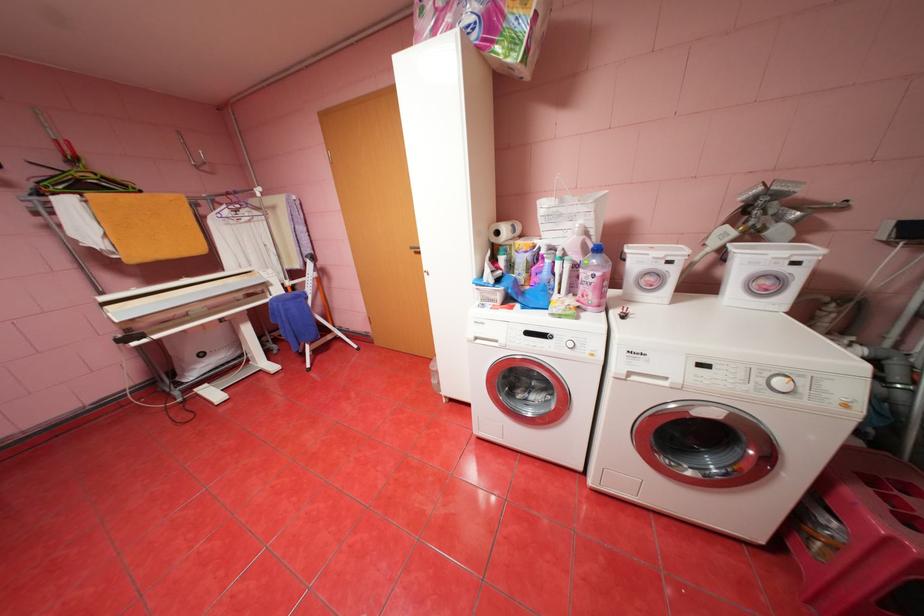
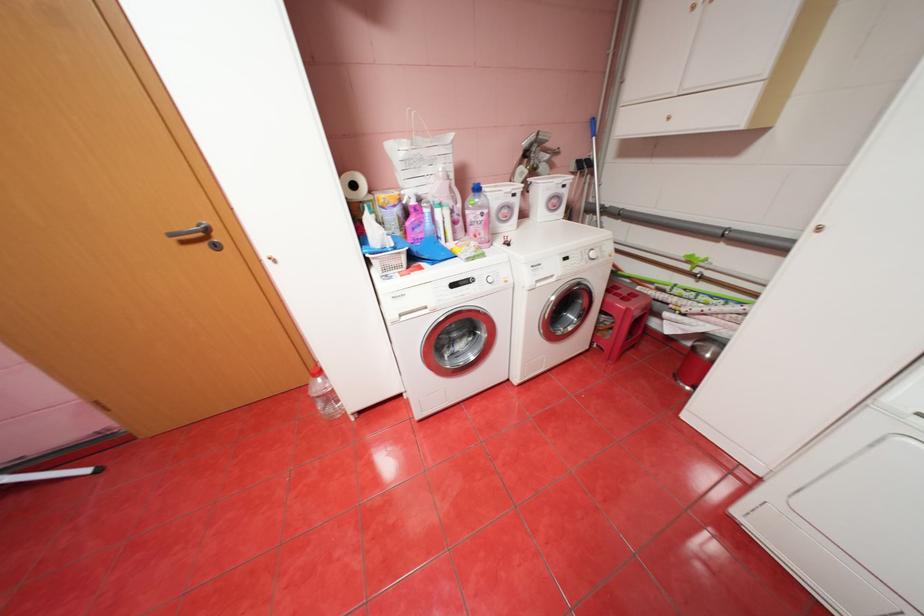
Where in the second image is the point corresponding to [590,286] from the first image?

(480, 228)